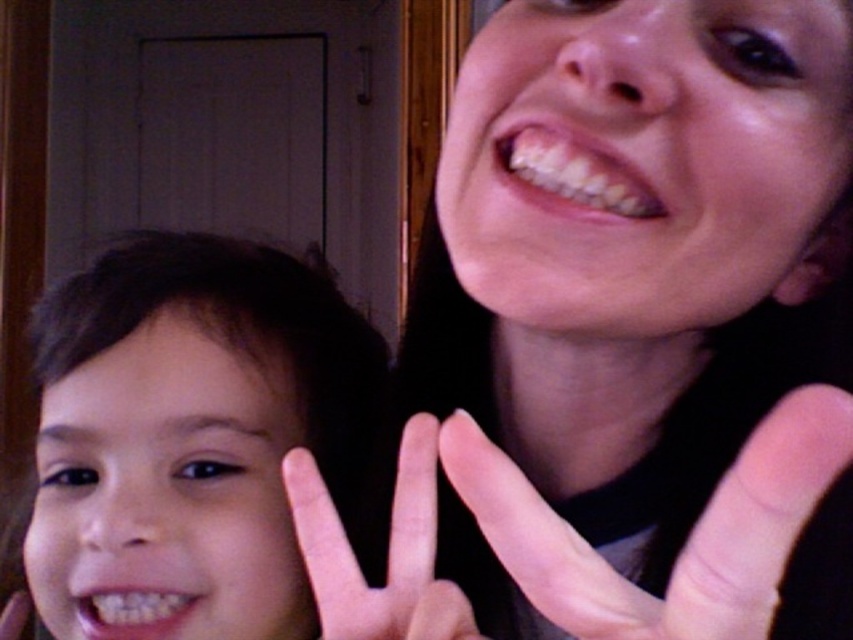
Does point (585, 589) lie behind point (421, 474)?

That is False.

Is pink flesh-toned hand at center taller than pink flesh-colored hand at center?

Yes.

Which is in front, point (695, 637) or point (318, 520)?

Point (695, 637) is in front.

This screenshot has height=640, width=853. I want to click on pink flesh-toned hand at center, so click(x=686, y=540).

Which is more to the right, smooth skin face at upper right or pink flesh-colored hand at center?

smooth skin face at upper right is more to the right.

Which is in front, point (820, 148) or point (328, 524)?

Point (328, 524)

Where is `smooth skin face at upper right`? This screenshot has width=853, height=640. smooth skin face at upper right is located at coordinates (637, 326).

Image resolution: width=853 pixels, height=640 pixels. Identify the location of smooth skin face at upper right. (637, 326).

Can you confirm if smooth skin face at upper right is positioned to the left of brown hair at left?

In fact, smooth skin face at upper right is to the right of brown hair at left.

Is smooth skin face at upper right shorter than brown hair at left?

In fact, smooth skin face at upper right may be taller than brown hair at left.

You are a GUI agent. You are given a task and a screenshot of the screen. Output one action in this format:
    pyautogui.click(x=<x>, y=<y>)
    Task: Click on the smooth skin face at upper right
    The height and width of the screenshot is (640, 853).
    Given the screenshot: What is the action you would take?
    pyautogui.click(x=637, y=326)

Locate an element on the screen. smooth skin face at upper right is located at coordinates (637, 326).